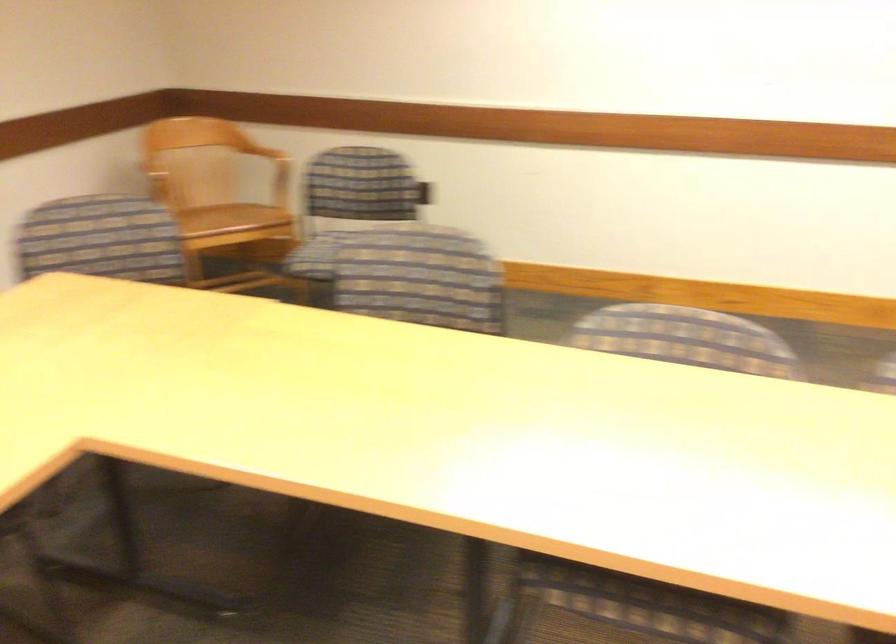
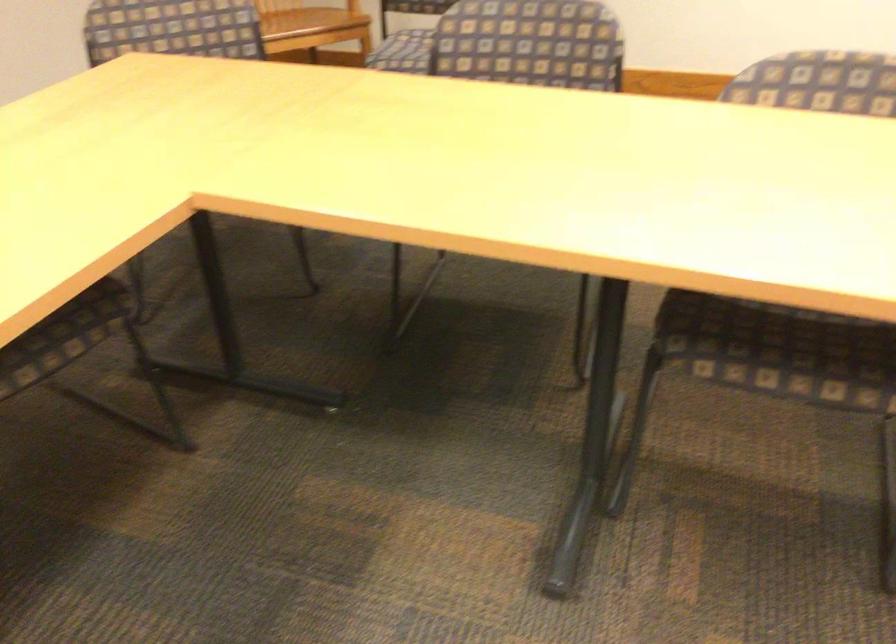
Question: The images are taken continuously from a first-person perspective. In which direction is your viewpoint rotating?

Choices:
 (A) Left
 (B) Right
 (C) Up
 (D) Down

Answer: (D)